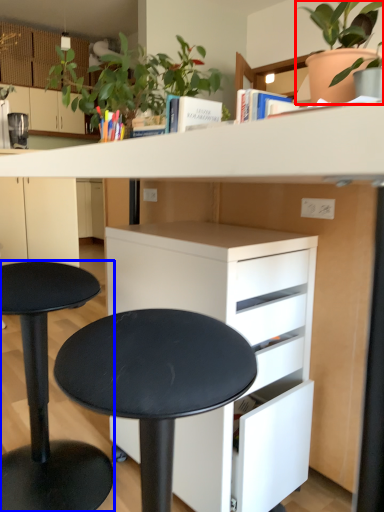
Question: Which of the following is the closest to the observer, houseplant (highlighted by a red box) or stool (highlighted by a blue box)?

Choices:
 (A) houseplant
 (B) stool

Answer: (B)